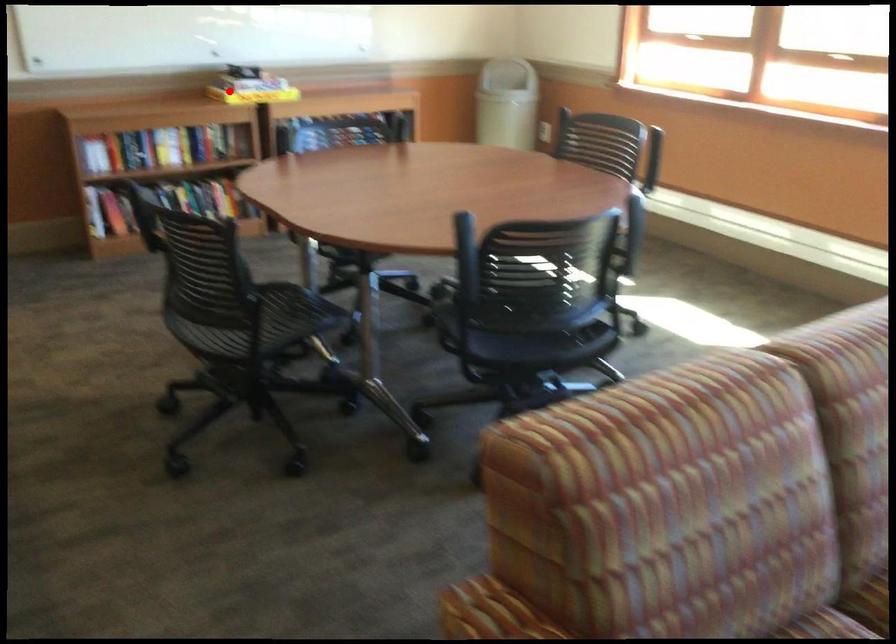
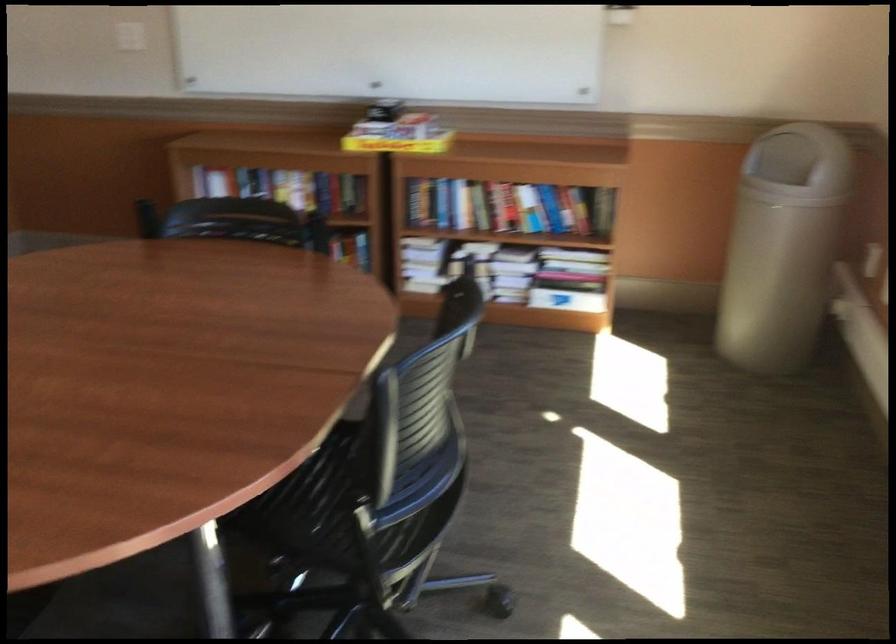
Question: A red point is marked in image1. In image2, is the corresponding 3D point closer to the camera or farther? Reply with the corresponding letter.

Choices:
 (A) The corresponding 3D point is closer.
 (B) The corresponding 3D point is farther.

Answer: (A)